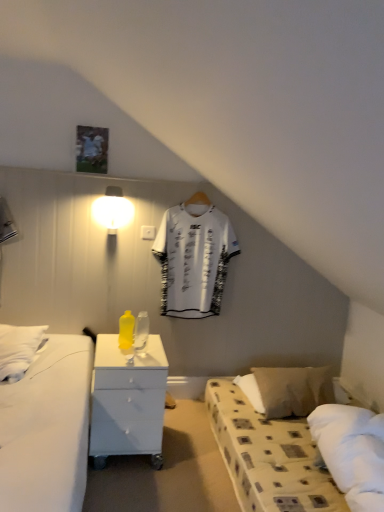
Where is `free space to the left of transparent glass bottle at center, acting as the 1th bottle starting from the right`? Image resolution: width=384 pixels, height=512 pixels. free space to the left of transparent glass bottle at center, acting as the 1th bottle starting from the right is located at coordinates (115, 351).